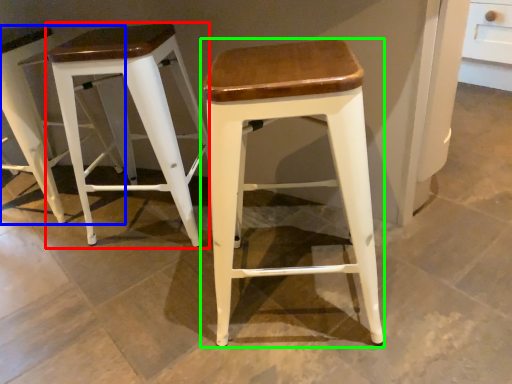
Question: Which object is positioned farthest from stool (highlighted by a red box)? Select from stool (highlighted by a blue box) and stool (highlighted by a green box).

Choices:
 (A) stool
 (B) stool

Answer: (B)